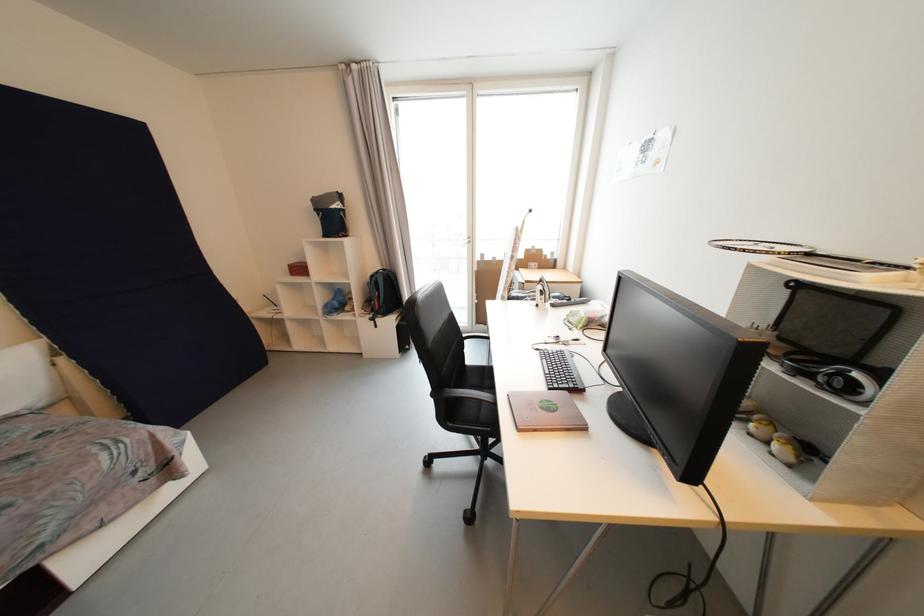
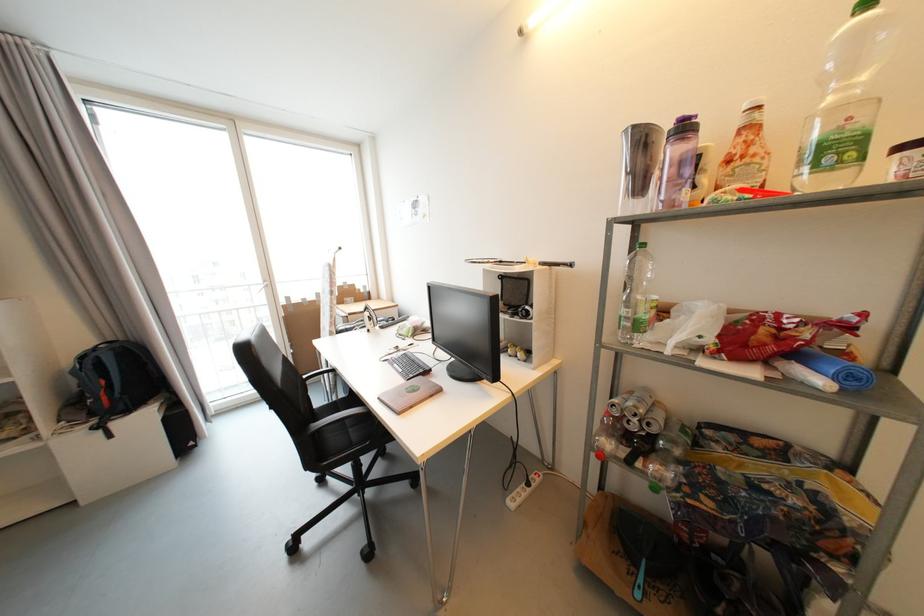
In the second image, find the point that corresponds to (473,240) in the first image.

(271, 283)